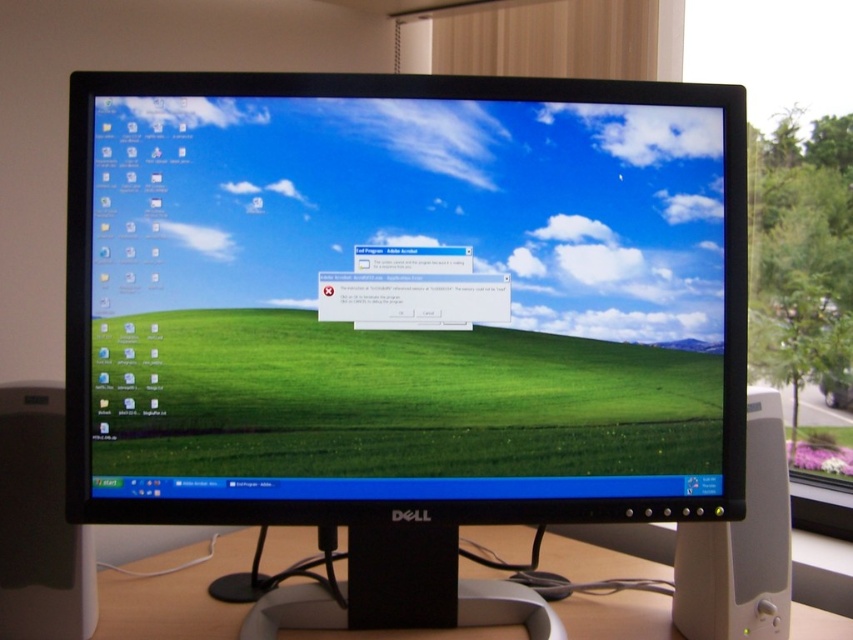
You are setting up a new monitor and want to place it on the desk. Based on the image, will the matte plastic monitor at center fit vertically on the white plastic computer desk at center?

The matte plastic monitor at center is taller than the white plastic computer desk at center, so it will not fit vertically on the desk.

You need to place a new keyboard that is 40 cm wide on the desk. Given that the matte plastic monitor at center is already placed, can the keyboard fit on the white plastic computer desk at center without overlapping the monitor?

The matte plastic monitor at center has a lesser width compared to white plastic computer desk at center. Since the monitor is smaller in width, there should be enough space on the white plastic computer desk at center to place the 40 cm wide keyboard without overlapping the monitor.

You are trying to locate a specific point on the Dell computer monitor. The point is at coordinates point (410, 300). According to the image, where exactly is this point located?

The point (410, 300) corresponds to the matte plastic monitor at center.